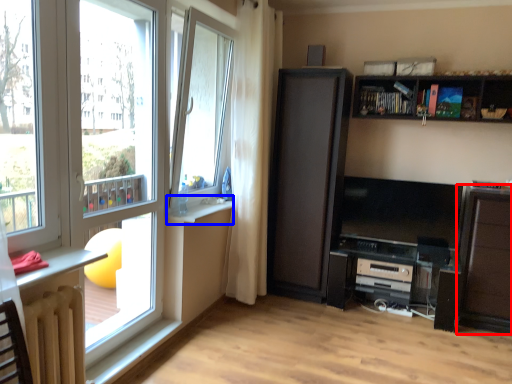
Question: Which object is further to the camera taking this photo, cabinetry (highlighted by a red box) or window sill (highlighted by a blue box)?

Choices:
 (A) cabinetry
 (B) window sill

Answer: (A)